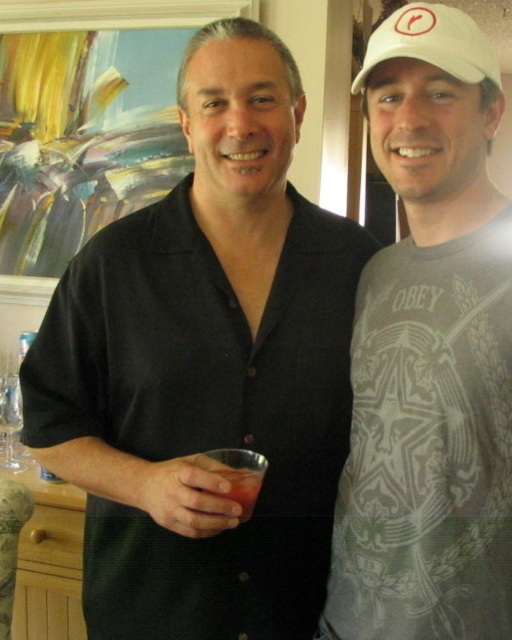
Please look at the scene where two people are standing indoors with a colorful abstract painting in the background. You see a black button up shirt at center and a gray t shirt with graphic design and the word obey on it. Can you tell me which object is located at the coordinate point (205, 369)?

The point at coordinate (205, 369) indicates the location of the black cotton shirt at center.